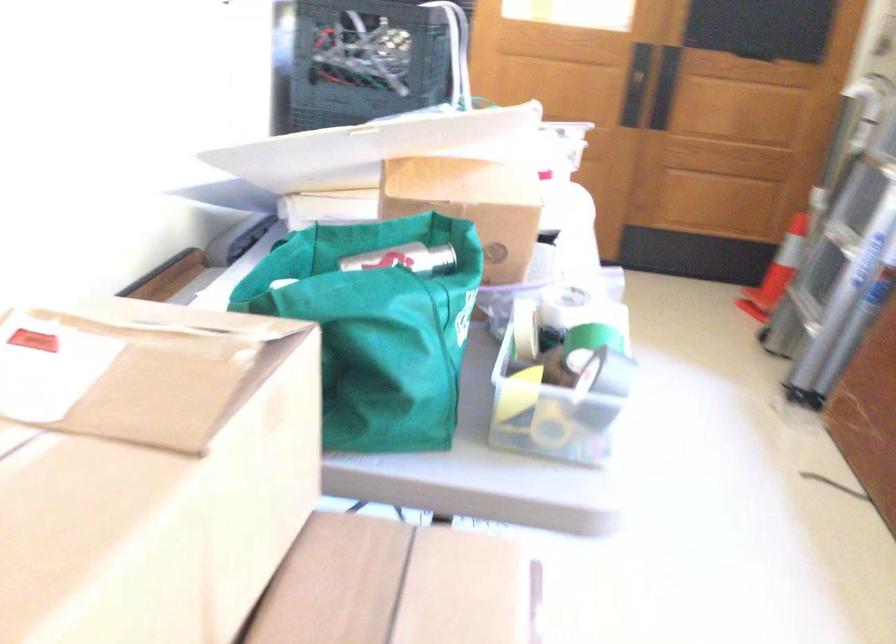
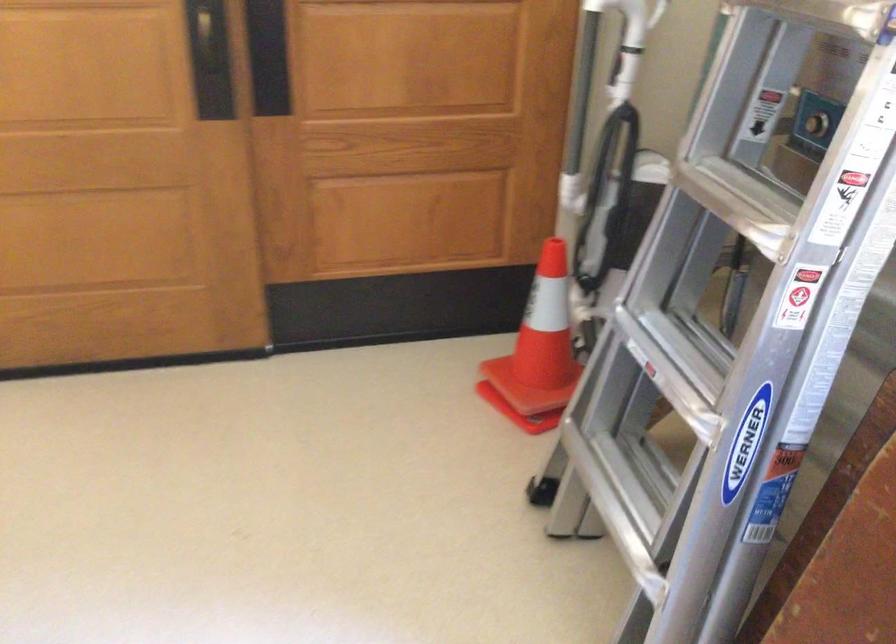
Find the pixel in the second image that matches point (679, 80) in the first image.

(268, 51)